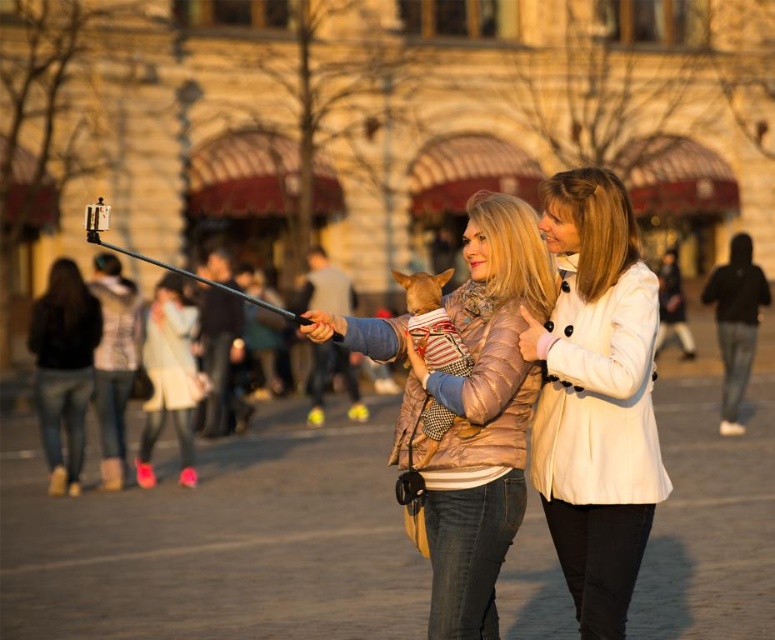
Question: Where is white matte coat at center located in relation to metallic gold jacket at center in the image?

Choices:
 (A) right
 (B) left

Answer: (A)

Question: Can you confirm if white matte coat at center is positioned below jeans at left?

Choices:
 (A) no
 (B) yes

Answer: (A)

Question: Is white matte coat at center positioned before metallic gold jacket at center?

Choices:
 (A) yes
 (B) no

Answer: (B)

Question: Considering the real-world distances, which object is farthest from the metallic gold jacket at center?

Choices:
 (A) white matte coat at center
 (B) striped fabric dog at center
 (C) jeans at left
 (D) metallic silver pole at center

Answer: (C)

Question: Which of the following is the farthest from the observer?

Choices:
 (A) metallic silver pole at center
 (B) striped fabric dog at center

Answer: (A)

Question: Considering the real-world distances, which object is farthest from the metallic silver pole at center?

Choices:
 (A) metallic gold jacket at center
 (B) white matte coat at center
 (C) jeans at left

Answer: (B)